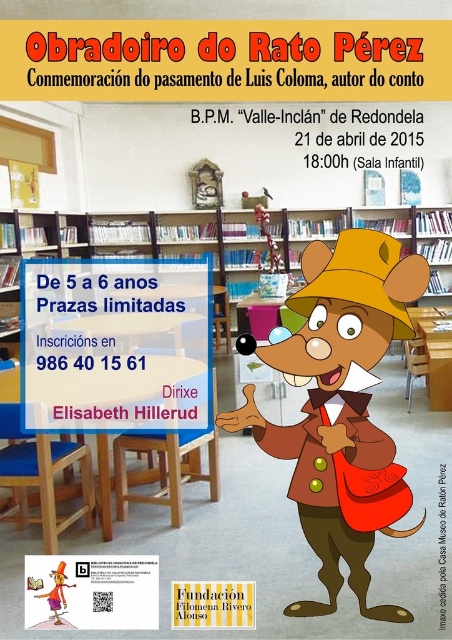
Can you confirm if brown fabric mouse at center is wider than matte yellow hat at upper center?

Correct, the width of brown fabric mouse at center exceeds that of matte yellow hat at upper center.

Who is taller, brown fabric mouse at center or matte yellow hat at upper center?

brown fabric mouse at center is taller.

Between point (324, 470) and point (59, 564), which one is positioned behind?

Point (59, 564)

The image size is (452, 640). In order to click on brown fabric mouse at center in this screenshot , I will do `click(342, 406)`.

Which is behind, point (274, 241) or point (59, 564)?

Point (274, 241)

I want to click on wooden bookshelf at center, so click(x=132, y=240).

Can you confirm if brown fabric mouse at center is smaller than wooden bookshelf at center?

Indeed, brown fabric mouse at center has a smaller size compared to wooden bookshelf at center.

Who is taller, brown fabric mouse at center or wooden bookshelf at center?

With more height is wooden bookshelf at center.

You are a GUI agent. You are given a task and a screenshot of the screen. Output one action in this format:
    pyautogui.click(x=<x>, y=<y>)
    Task: Click on the brown fabric mouse at center
    The height and width of the screenshot is (640, 452).
    Given the screenshot: What is the action you would take?
    pyautogui.click(x=342, y=406)

What are the coordinates of `brown fabric mouse at center` in the screenshot? It's located at (342, 406).